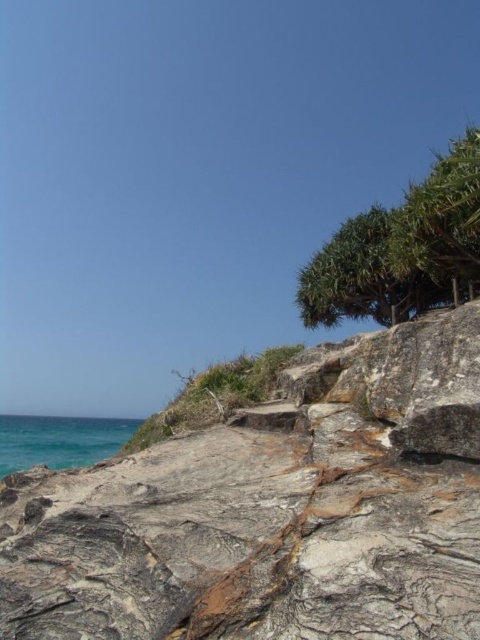
Question: Which of the following is the farthest from the observer?

Choices:
 (A) (0, 456)
 (B) (457, 458)

Answer: (A)

Question: Considering the relative positions of green leafy tree at upper right and teal water at lower left in the image provided, where is green leafy tree at upper right located with respect to teal water at lower left?

Choices:
 (A) left
 (B) right

Answer: (B)

Question: Does gray rough rock at lower left appear under green leafy tree at upper right?

Choices:
 (A) no
 (B) yes

Answer: (B)

Question: Estimate the real-world distances between objects in this image. Which object is farther from the teal water at lower left?

Choices:
 (A) gray rough rock at lower left
 (B) green leafy tree at upper right

Answer: (B)

Question: Can you confirm if green leafy tree at upper right is positioned above teal water at lower left?

Choices:
 (A) yes
 (B) no

Answer: (A)

Question: Considering the real-world distances, which object is farthest from the gray rough rock at lower left?

Choices:
 (A) green leafy tree at upper right
 (B) teal water at lower left

Answer: (B)